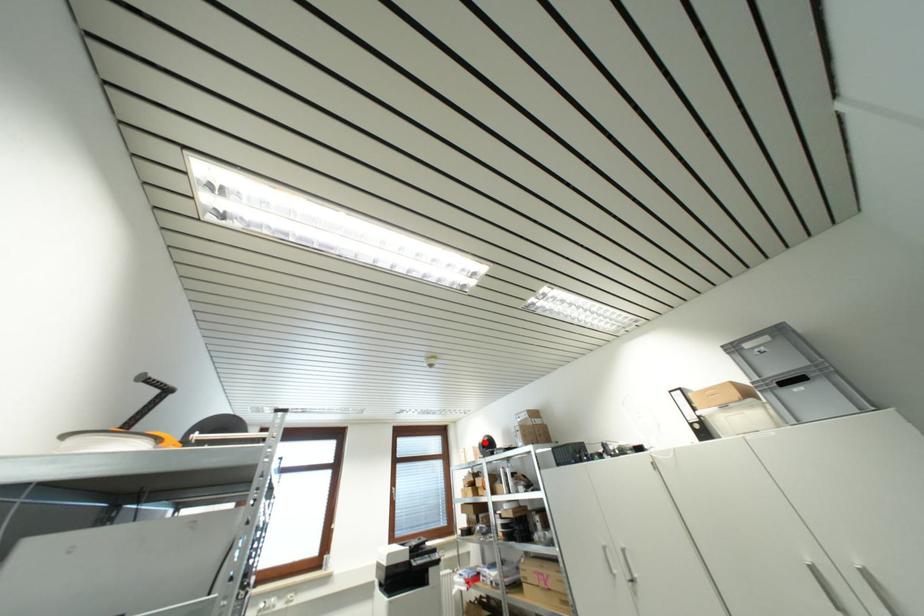
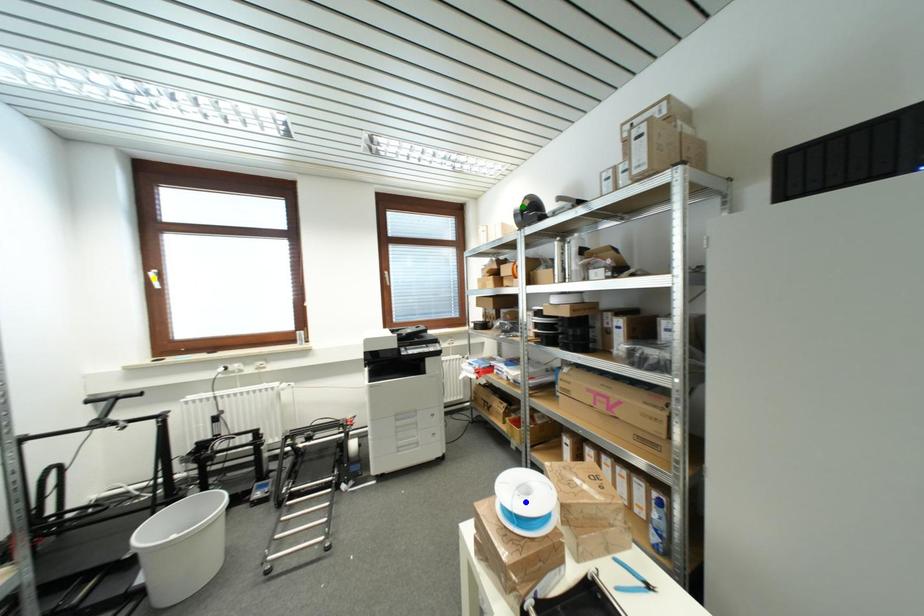
Question: I am providing you with two images of the same scene from different viewpoints. A red point is marked on the first image. You are given multiple points on the second image. Which mark in image 2 goes with the point in image 1?

Choices:
 (A) yellow point
 (B) green point
 (C) blue point

Answer: (B)